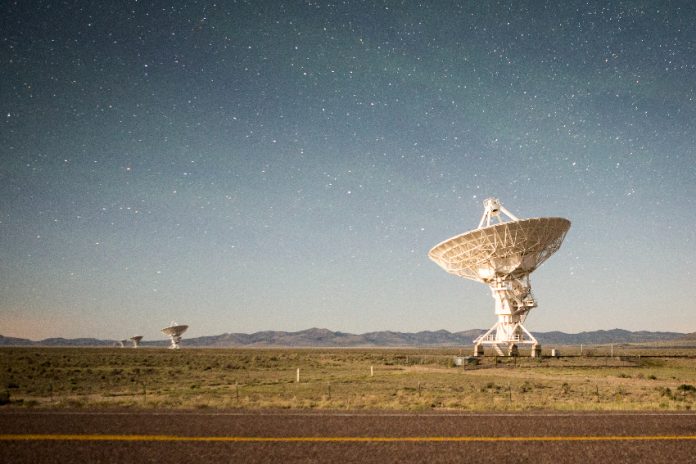
Where is `stairs`? stairs is located at coordinates (500, 350).